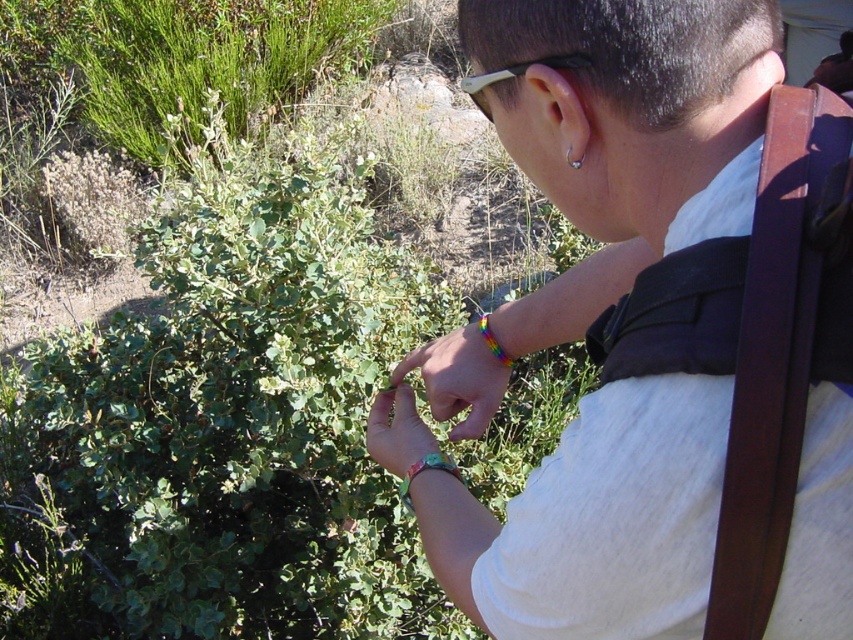
Question: Can you confirm if rainbow bracelet at center is wider than smooth green leaf at center?

Choices:
 (A) no
 (B) yes

Answer: (B)

Question: Which object is farther from the camera taking this photo?

Choices:
 (A) white fabric shirt at upper right
 (B) rainbow beaded bracelet at upper right
 (C) white plastic goggles at upper center

Answer: (B)

Question: Is smooth green leaf at center positioned behind rainbow beaded bracelet at upper right?

Choices:
 (A) yes
 (B) no

Answer: (B)

Question: Which point is farther from the camera taking this photo?

Choices:
 (A) (500, 356)
 (B) (631, 586)
 (C) (572, 61)
 (D) (381, 442)

Answer: (A)

Question: Does white fabric shirt at upper right have a greater width compared to white plastic goggles at upper center?

Choices:
 (A) no
 (B) yes

Answer: (B)

Question: Which point appears closest to the camera in this image?

Choices:
 (A) (392, 404)
 (B) (495, 355)
 (C) (494, 321)
 (D) (512, 77)

Answer: (D)